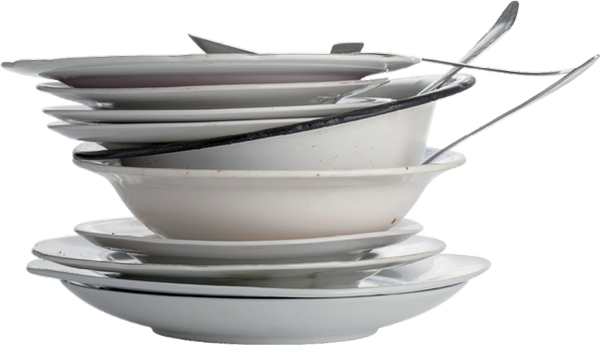
I want to click on dishes, so click(322, 332), click(370, 259), click(352, 239), click(351, 198), click(348, 122), click(258, 120), click(235, 107), click(240, 90), click(241, 64).